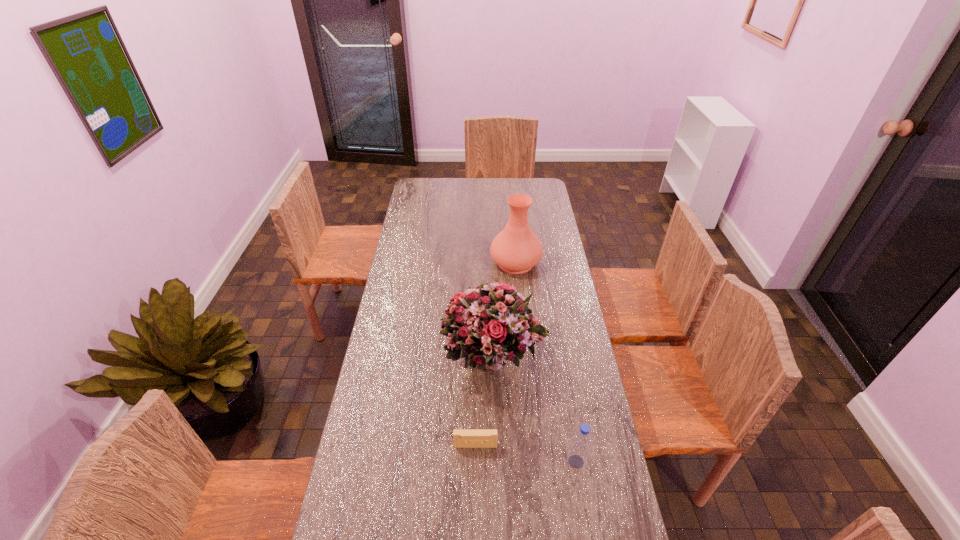
In order to click on the farthest object in this screenshot , I will do `click(516, 249)`.

Locate an element on the screen. The height and width of the screenshot is (540, 960). bouquet is located at coordinates (489, 324).

Where is `the third tallest object`? This screenshot has width=960, height=540. the third tallest object is located at coordinates (578, 453).

Locate an element on the screen. the nearest object is located at coordinates (578, 453).

This screenshot has height=540, width=960. In order to click on the second nearest object in this screenshot , I will do `click(463, 438)`.

Image resolution: width=960 pixels, height=540 pixels. I want to click on the shortest object, so (463, 438).

Identify the location of vacant area located on the back of the farthest object. (511, 214).

Identify the location of vacant space situated 0.180m on the front of the bouquet. (497, 451).

Locate an element on the screen. The height and width of the screenshot is (540, 960). vacant space located on the front of the bottle is located at coordinates (585, 514).

Locate an element on the screen. The width and height of the screenshot is (960, 540). free point located 0.110m at the front of the third farthest object with spools is located at coordinates (475, 485).